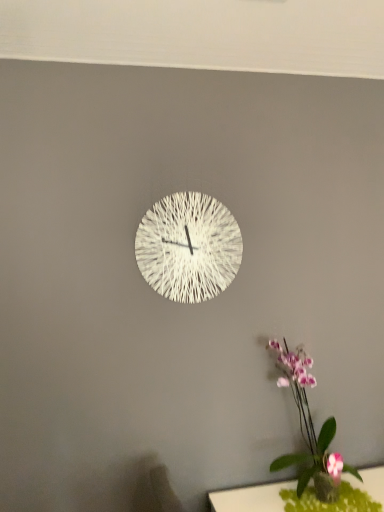
Question: Is green felt table at lower right inside the boundaries of purple-pink orchid at lower right, or outside?

Choices:
 (A) inside
 (B) outside

Answer: (B)

Question: Considering the positions of green felt table at lower right and purple-pink orchid at lower right in the image, is green felt table at lower right wider or thinner than purple-pink orchid at lower right?

Choices:
 (A) wide
 (B) thin

Answer: (A)

Question: Estimate the real-world distances between objects in this image. Which object is closer to the white woven clock at center?

Choices:
 (A) purple-pink orchid at lower right
 (B) green felt table at lower right

Answer: (A)

Question: Estimate the real-world distances between objects in this image. Which object is closer to the white woven clock at center?

Choices:
 (A) purple-pink orchid at lower right
 (B) green felt table at lower right

Answer: (A)